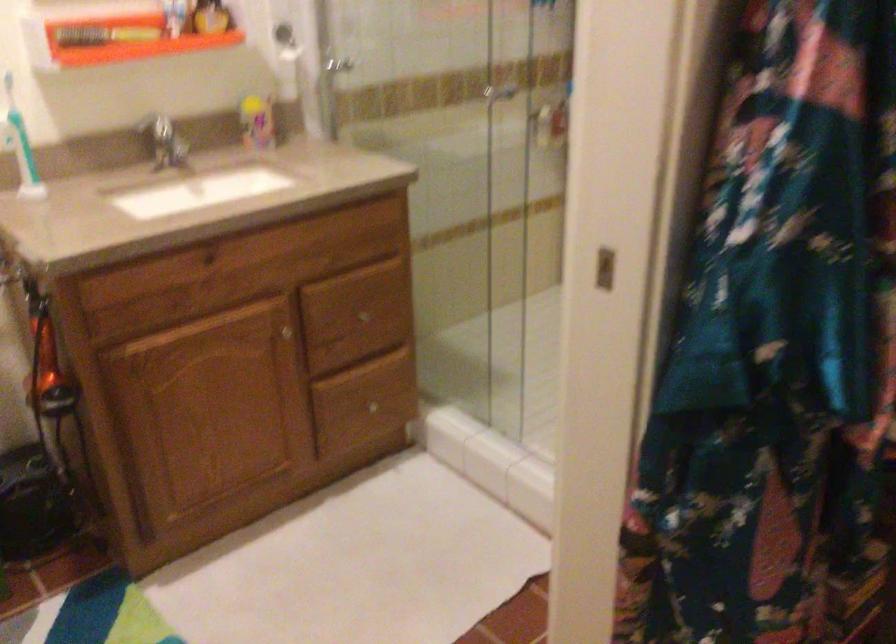
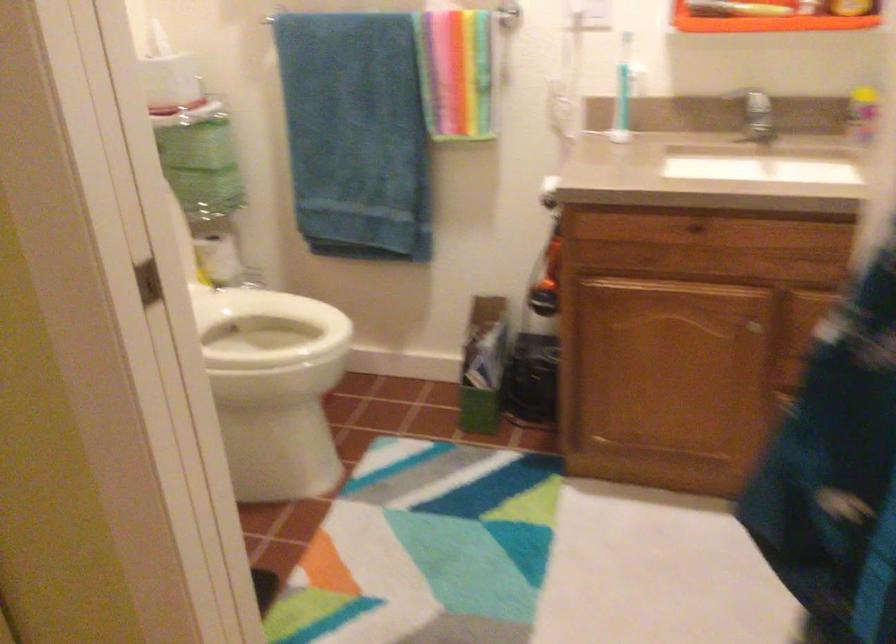
Question: The camera is either moving clockwise (left) or counter-clockwise (right) around the object. The first image is from the beginning of the video and the second image is from the end. Is the camera moving left or right when shooting the video?

Choices:
 (A) Left
 (B) Right

Answer: (B)